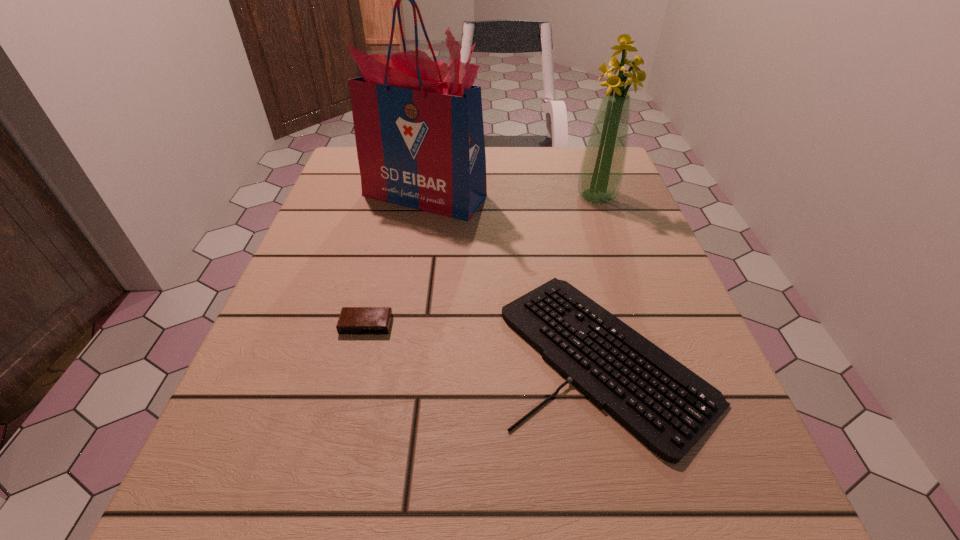
Locate an element on the screen. The width and height of the screenshot is (960, 540). grocery bag present at the left edge is located at coordinates (418, 123).

You are a GUI agent. You are given a task and a screenshot of the screen. Output one action in this format:
    pyautogui.click(x=<x>, y=<y>)
    Task: Click on the alarm clock that is positioned at the left edge
    Image resolution: width=960 pixels, height=540 pixels.
    Given the screenshot: What is the action you would take?
    pyautogui.click(x=353, y=320)

This screenshot has width=960, height=540. I want to click on bouquet at the right edge, so click(x=602, y=168).

Where is `computer keyboard at the right edge`? The width and height of the screenshot is (960, 540). computer keyboard at the right edge is located at coordinates (666, 406).

The width and height of the screenshot is (960, 540). What are the coordinates of `object situated at the far left corner` in the screenshot? It's located at (418, 123).

Locate an element on the screen. The height and width of the screenshot is (540, 960). object that is at the far right corner is located at coordinates (602, 168).

Locate an element on the screen. This screenshot has width=960, height=540. vacant space at the far edge is located at coordinates (520, 171).

Image resolution: width=960 pixels, height=540 pixels. In the image, there is a desktop. Identify the location of free space at the near edge. (575, 529).

This screenshot has width=960, height=540. I want to click on free region at the left edge of the desktop, so click(x=266, y=376).

Identify the location of free spot at the right edge of the desktop. (675, 327).